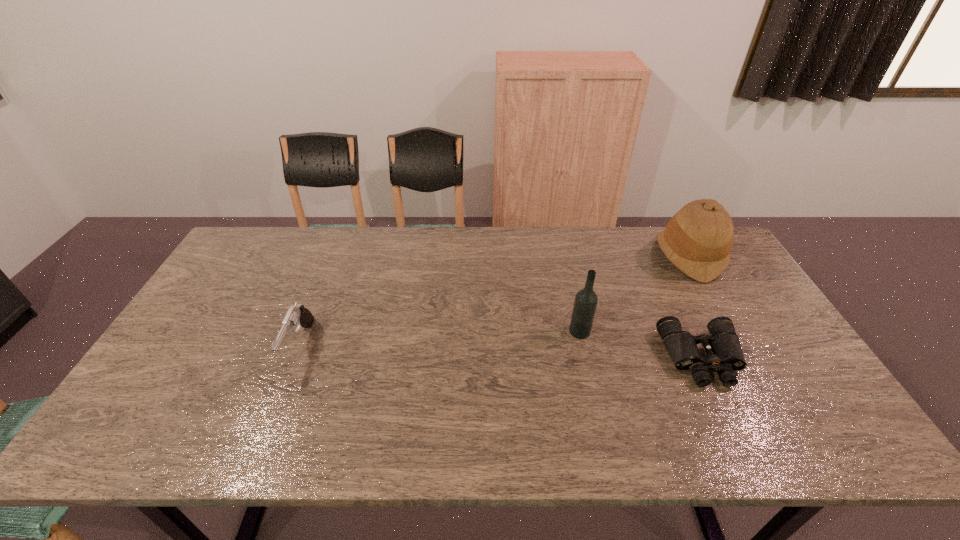
This screenshot has height=540, width=960. Find the location of `vacant space in between the farthest object and the third object from right to left`. vacant space in between the farthest object and the third object from right to left is located at coordinates (635, 294).

Locate an element on the screen. free space between the hat and the shortest object is located at coordinates (695, 307).

Where is `vacant space that's between the second shortest object and the hat`? Image resolution: width=960 pixels, height=540 pixels. vacant space that's between the second shortest object and the hat is located at coordinates (494, 301).

The height and width of the screenshot is (540, 960). Find the location of `blank region between the farthest object and the binoculars`. blank region between the farthest object and the binoculars is located at coordinates (695, 307).

Where is `free space between the binoculars and the gun`? The image size is (960, 540). free space between the binoculars and the gun is located at coordinates (501, 352).

You are a GUI agent. You are given a task and a screenshot of the screen. Output one action in this format:
    pyautogui.click(x=<x>, y=<y>)
    Task: Click on the free area in between the vodka and the second shortest object
    
    Given the screenshot: What is the action you would take?
    [440, 339]

At what (x,y) coordinates should I click in order to perform the action: click on vacant space that's between the vodka and the binoculars. Please return your answer as a coordinate pair (x, y). The image size is (960, 540). Looking at the image, I should click on (641, 345).

Where is `unoccupied area between the hat and the third object from right to left`? The width and height of the screenshot is (960, 540). unoccupied area between the hat and the third object from right to left is located at coordinates (635, 294).

Identify the location of free space between the second object from left to right and the hat. (635, 294).

Identify the location of free space between the shortest object and the hat. (695, 307).